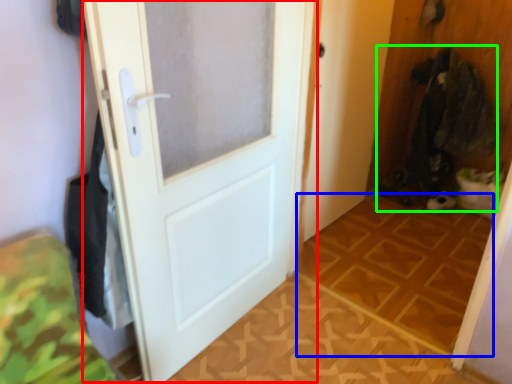
Question: Which object is positioned farthest from door (highlighted by a red box)? Select from tile (highlighted by a blue box) and laundry (highlighted by a green box).

Choices:
 (A) tile
 (B) laundry

Answer: (B)